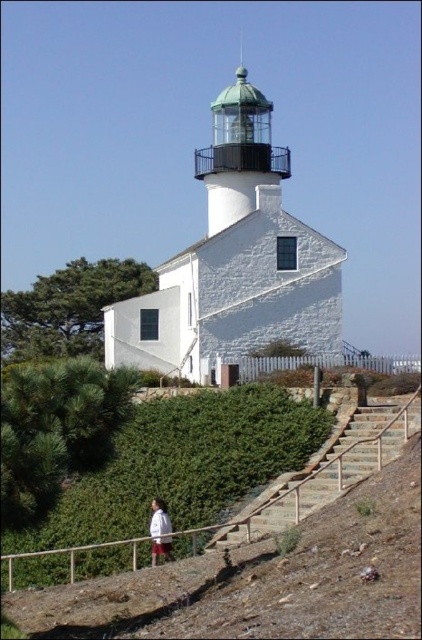
Can you confirm if brown wooden rail at lower center is positioned above brown stone stairs at lower right?

No, brown wooden rail at lower center is not above brown stone stairs at lower right.

Find the location of a particular element. brown wooden rail at lower center is located at coordinates (314, 477).

This screenshot has height=640, width=422. I want to click on brown wooden rail at lower center, so click(x=314, y=477).

Between brown wooden rail at lower center and white cotton shirt at lower center, which one appears on the left side from the viewer's perspective?

Positioned to the left is white cotton shirt at lower center.

Describe the element at coordinates (314, 477) in the screenshot. I see `brown wooden rail at lower center` at that location.

What do you see at coordinates (314, 477) in the screenshot? I see `brown wooden rail at lower center` at bounding box center [314, 477].

Find the location of a particular element. brown wooden rail at lower center is located at coordinates (314, 477).

Does brown stone stairs at lower right have a smaller size compared to white cotton shirt at lower center?

No.

Does brown stone stairs at lower right come behind white cotton shirt at lower center?

No, it is in front of white cotton shirt at lower center.

In order to click on brown stone stairs at lower right in this screenshot , I will do `click(327, 472)`.